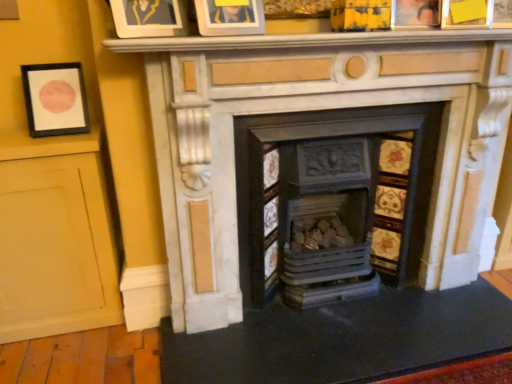
Describe the element at coordinates (55, 99) in the screenshot. I see `matte black picture frame at left, which is the 1th picture frame in left-to-right order` at that location.

Measure the distance between point (x=170, y=0) and camera.

A distance of 4.68 feet exists between point (x=170, y=0) and camera.

This screenshot has width=512, height=384. Find the location of `yellow paper picture frame at upper right, positioned as the 1th picture frame in right-to-left order`. yellow paper picture frame at upper right, positioned as the 1th picture frame in right-to-left order is located at coordinates (466, 14).

Considering the sizes of matte gold picture frame at upper center, the 3th picture frame in the right-to-left sequence, and matte black picture frame at left, which is the 1th picture frame in left-to-right order, in the image, is matte gold picture frame at upper center, the 3th picture frame in the right-to-left sequence, taller or shorter than matte black picture frame at left, which is the 1th picture frame in left-to-right order,?

In the image, matte gold picture frame at upper center, the 3th picture frame in the right-to-left sequence, appears to be shorter than matte black picture frame at left, which is the 1th picture frame in left-to-right order.

How distant is matte gold picture frame at upper center, which ranks as the second picture frame in left-to-right order, from matte black picture frame at left, which is the 1th picture frame in left-to-right order?

A distance of 21.33 inches exists between matte gold picture frame at upper center, which ranks as the second picture frame in left-to-right order, and matte black picture frame at left, which is the 1th picture frame in left-to-right order.

Is matte gold picture frame at upper center, which ranks as the second picture frame in left-to-right order, facing towards matte black picture frame at left, which is the 1th picture frame in left-to-right order?

No, matte gold picture frame at upper center, which ranks as the second picture frame in left-to-right order, is not oriented towards matte black picture frame at left, which is the 1th picture frame in left-to-right order.

Is matte gold picture frame at upper center, the 3th picture frame in the right-to-left sequence, touching matte black picture frame at left, which ranks as the 4th picture frame in right-to-left order?

They are not placed beside each other.

Is white marble fireplace at center, which is the second fireplace in left-to-right order, beside yellow paper picture frame at upper right, positioned as the 1th picture frame in right-to-left order?

There is a gap between white marble fireplace at center, which is the second fireplace in left-to-right order, and yellow paper picture frame at upper right, positioned as the 1th picture frame in right-to-left order.

Does white marble fireplace at center, arranged as the first fireplace when viewed from the right, have a lesser width compared to yellow paper picture frame at upper right, positioned as the 1th picture frame in right-to-left order?

No, white marble fireplace at center, arranged as the first fireplace when viewed from the right, is not thinner than yellow paper picture frame at upper right, positioned as the 1th picture frame in right-to-left order.

Can you confirm if white marble fireplace at center, which is the second fireplace in left-to-right order, is bigger than yellow paper picture frame at upper right, positioned as the 1th picture frame in right-to-left order?

Yes.

Is yellow paper picture frame at upper right, which is the 4th picture frame from left to right, inside white marble fireplace at center, arranged as the first fireplace when viewed from the right?

No, white marble fireplace at center, arranged as the first fireplace when viewed from the right, does not contain yellow paper picture frame at upper right, which is the 4th picture frame from left to right.

In terms of size, does matte gold picture frame at upper center, which ranks as the second picture frame in left-to-right order, appear bigger or smaller than yellow paper picture frame at upper right, which is the 4th picture frame from left to right?

In the image, matte gold picture frame at upper center, which ranks as the second picture frame in left-to-right order, appears to be larger than yellow paper picture frame at upper right, which is the 4th picture frame from left to right.

From the image's perspective, count 1st picture frames downward from the yellow paper picture frame at upper right, which is the 4th picture frame from left to right, and point to it. Please provide its 2D coordinates.

[(149, 18)]

Looking at their sizes, would you say matte gold picture frame at upper center, the 3th picture frame in the right-to-left sequence, is wider or thinner than yellow paper picture frame at upper right, which is the 4th picture frame from left to right?

Considering their sizes, matte gold picture frame at upper center, the 3th picture frame in the right-to-left sequence, looks broader than yellow paper picture frame at upper right, which is the 4th picture frame from left to right.

Based on the photo, which is more to the left, matte black picture frame at left, which is the 1th picture frame in left-to-right order, or wooden photo frame at upper right, the 3th picture frame positioned from the left?

matte black picture frame at left, which is the 1th picture frame in left-to-right order, is more to the left.

Would you consider matte black picture frame at left, which is the 1th picture frame in left-to-right order, to be distant from wooden photo frame at upper right, the 3th picture frame positioned from the left?

matte black picture frame at left, which is the 1th picture frame in left-to-right order, is far away from wooden photo frame at upper right, the 3th picture frame positioned from the left.

Can wooden photo frame at upper right, the 3th picture frame positioned from the left, be found inside matte black picture frame at left, which is the 1th picture frame in left-to-right order?

Actually, wooden photo frame at upper right, the 3th picture frame positioned from the left, is outside matte black picture frame at left, which is the 1th picture frame in left-to-right order.

Is wooden photo frame at upper right, which is counted as the second picture frame, starting from the right, at the back of matte black picture frame at left, which is the 1th picture frame in left-to-right order?

No, matte black picture frame at left, which is the 1th picture frame in left-to-right order,'s orientation is not away from wooden photo frame at upper right, which is counted as the second picture frame, starting from the right.

The height and width of the screenshot is (384, 512). In the image, there is a rustic wood logs at center, positioned as the first fireplace in left-to-right order. Identify the location of fireplace above it (from the image's perspective). (309, 110).

Is the surface of rustic wood logs at center, positioned as the first fireplace in left-to-right order, in direct contact with white marble fireplace at center, which is the second fireplace in left-to-right order?

There is a gap between rustic wood logs at center, positioned as the first fireplace in left-to-right order, and white marble fireplace at center, which is the second fireplace in left-to-right order.

Between rustic wood logs at center, positioned as the first fireplace in left-to-right order, and white marble fireplace at center, which is the second fireplace in left-to-right order, which one has smaller size?

With smaller size is rustic wood logs at center, positioned as the first fireplace in left-to-right order.

From the picture: Which of these two, rustic wood logs at center, which is the 2th fireplace from right to left, or white marble fireplace at center, arranged as the first fireplace when viewed from the right, stands shorter?

rustic wood logs at center, which is the 2th fireplace from right to left, is shorter.

Is yellow paper picture frame at upper right, which is the 4th picture frame from left to right, facing towards white marble fireplace at center, which is the second fireplace in left-to-right order?

No, yellow paper picture frame at upper right, which is the 4th picture frame from left to right, is not aimed at white marble fireplace at center, which is the second fireplace in left-to-right order.

Does point (451, 24) come in front of point (217, 264)?

Yes.

Does yellow paper picture frame at upper right, which is the 4th picture frame from left to right, lie behind white marble fireplace at center, arranged as the first fireplace when viewed from the right?

Yes, yellow paper picture frame at upper right, which is the 4th picture frame from left to right, is further from the camera.

In terms of height, does yellow paper picture frame at upper right, which is the 4th picture frame from left to right, look taller or shorter compared to white marble fireplace at center, which is the second fireplace in left-to-right order?

Clearly, yellow paper picture frame at upper right, which is the 4th picture frame from left to right, is shorter compared to white marble fireplace at center, which is the second fireplace in left-to-right order.

The height and width of the screenshot is (384, 512). Identify the location of the 2nd picture frame counting from the left side of the rustic wood logs at center, which is the 2th fireplace from right to left. (55, 99).

Is rustic wood logs at center, which is the 2th fireplace from right to left, completely or partially inside matte black picture frame at left, which is the 1th picture frame in left-to-right order?

No.

Considering the relative sizes of matte black picture frame at left, which is the 1th picture frame in left-to-right order, and rustic wood logs at center, positioned as the first fireplace in left-to-right order, in the image provided, is matte black picture frame at left, which is the 1th picture frame in left-to-right order, bigger than rustic wood logs at center, positioned as the first fireplace in left-to-right order,?

Actually, matte black picture frame at left, which is the 1th picture frame in left-to-right order, might be smaller than rustic wood logs at center, positioned as the first fireplace in left-to-right order.

Is matte black picture frame at left, which ranks as the 4th picture frame in right-to-left order, beside rustic wood logs at center, which is the 2th fireplace from right to left?

There is a gap between matte black picture frame at left, which ranks as the 4th picture frame in right-to-left order, and rustic wood logs at center, which is the 2th fireplace from right to left.

In order to click on picture frame that is the 1st one when counting rightward from the matte black picture frame at left, which ranks as the 4th picture frame in right-to-left order in this screenshot , I will do `click(149, 18)`.

This screenshot has width=512, height=384. Find the location of `the 1st fireplace below the yellow paper picture frame at upper right, positioned as the 1th picture frame in right-to-left order (from a real-world perspective)`. the 1st fireplace below the yellow paper picture frame at upper right, positioned as the 1th picture frame in right-to-left order (from a real-world perspective) is located at coordinates (309, 110).

From the image, which object appears to be nearer to matte black picture frame at left, which is the 1th picture frame in left-to-right order, wooden photo frame at upper right, which is counted as the second picture frame, starting from the right, or rustic wood logs at center, positioned as the first fireplace in left-to-right order?

rustic wood logs at center, positioned as the first fireplace in left-to-right order, is positioned closer to the anchor matte black picture frame at left, which is the 1th picture frame in left-to-right order.

Based on the photo, when comparing their distances from yellow paper picture frame at upper right, which is the 4th picture frame from left to right, does white marble fireplace at center, which is the second fireplace in left-to-right order, or matte black picture frame at left, which is the 1th picture frame in left-to-right order, seem closer?

The object closer to yellow paper picture frame at upper right, which is the 4th picture frame from left to right, is white marble fireplace at center, which is the second fireplace in left-to-right order.

Considering their positions, is white marble fireplace at center, arranged as the first fireplace when viewed from the right, positioned closer to wooden photo frame at upper right, the 3th picture frame positioned from the left, than yellow paper picture frame at upper right, positioned as the 1th picture frame in right-to-left order?

Among the two, yellow paper picture frame at upper right, positioned as the 1th picture frame in right-to-left order, is located nearer to wooden photo frame at upper right, the 3th picture frame positioned from the left.

Looking at the image, which one is located closer to matte gold picture frame at upper center, the 3th picture frame in the right-to-left sequence, wooden photo frame at upper right, the 3th picture frame positioned from the left, or white marble fireplace at center, which is the second fireplace in left-to-right order?

The object closer to matte gold picture frame at upper center, the 3th picture frame in the right-to-left sequence, is white marble fireplace at center, which is the second fireplace in left-to-right order.

Looking at the image, which one is located closer to matte gold picture frame at upper center, the 3th picture frame in the right-to-left sequence, matte black picture frame at left, which is the 1th picture frame in left-to-right order, or wooden photo frame at upper right, the 3th picture frame positioned from the left?

The object closer to matte gold picture frame at upper center, the 3th picture frame in the right-to-left sequence, is matte black picture frame at left, which is the 1th picture frame in left-to-right order.

Estimate the real-world distances between objects in this image. Which object is further from matte black picture frame at left, which ranks as the 4th picture frame in right-to-left order, matte gold picture frame at upper center, the 3th picture frame in the right-to-left sequence, or white marble fireplace at center, which is the second fireplace in left-to-right order?

Based on the image, white marble fireplace at center, which is the second fireplace in left-to-right order, appears to be further to matte black picture frame at left, which ranks as the 4th picture frame in right-to-left order.

From the image, which object appears to be farther from white marble fireplace at center, which is the second fireplace in left-to-right order, matte black picture frame at left, which is the 1th picture frame in left-to-right order, or matte gold picture frame at upper center, the 3th picture frame in the right-to-left sequence?

matte black picture frame at left, which is the 1th picture frame in left-to-right order.

Looking at the image, which one is located closer to white marble fireplace at center, arranged as the first fireplace when viewed from the right, matte gold picture frame at upper center, which ranks as the second picture frame in left-to-right order, or matte black picture frame at left, which ranks as the 4th picture frame in right-to-left order?

The object closer to white marble fireplace at center, arranged as the first fireplace when viewed from the right, is matte gold picture frame at upper center, which ranks as the second picture frame in left-to-right order.

The width and height of the screenshot is (512, 384). Find the location of `fireplace between wooden photo frame at upper right, the 3th picture frame positioned from the left, and rustic wood logs at center, which is the 2th fireplace from right to left, in the up-down direction`. fireplace between wooden photo frame at upper right, the 3th picture frame positioned from the left, and rustic wood logs at center, which is the 2th fireplace from right to left, in the up-down direction is located at coordinates tap(309, 110).

Find the location of a particular element. The width and height of the screenshot is (512, 384). picture frame located between matte black picture frame at left, which ranks as the 4th picture frame in right-to-left order, and white marble fireplace at center, which is the second fireplace in left-to-right order, in the left-right direction is located at coordinates (149, 18).

Locate an element on the screen. fireplace that lies between yellow paper picture frame at upper right, which is the 4th picture frame from left to right, and rustic wood logs at center, positioned as the first fireplace in left-to-right order, from top to bottom is located at coordinates (309, 110).

You are a GUI agent. You are given a task and a screenshot of the screen. Output one action in this format:
    pyautogui.click(x=<x>, y=<y>)
    Task: Click on the picture frame between matte black picture frame at left, which ranks as the 4th picture frame in right-to-left order, and rustic wood logs at center, which is the 2th fireplace from right to left, in the horizontal direction
    The width and height of the screenshot is (512, 384).
    Given the screenshot: What is the action you would take?
    pyautogui.click(x=149, y=18)